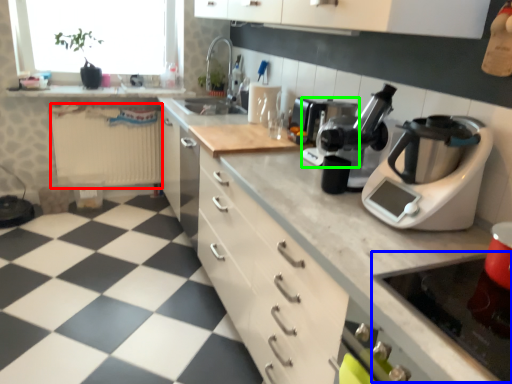
Question: Which object is the closest to the radiator (highlighted by a red box)? Choose among these: gas stove (highlighted by a blue box) or coffee machine (highlighted by a green box).

Choices:
 (A) gas stove
 (B) coffee machine

Answer: (B)